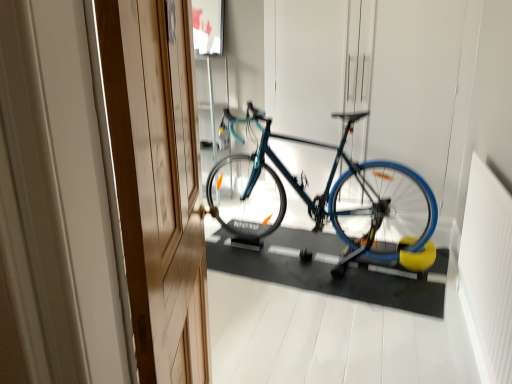
Question: Is wooden door at left taller or shorter than shiny blue bicycle at center?

Choices:
 (A) short
 (B) tall

Answer: (B)

Question: From a real-world perspective, is wooden door at left physically located above or below shiny blue bicycle at center?

Choices:
 (A) below
 (B) above

Answer: (B)

Question: From the image's perspective, relative to shiny blue bicycle at center, is wooden door at left above or below?

Choices:
 (A) above
 (B) below

Answer: (B)

Question: Looking at their shapes, would you say shiny blue bicycle at center is wider or thinner than wooden door at left?

Choices:
 (A) thin
 (B) wide

Answer: (B)

Question: From the image's perspective, is shiny blue bicycle at center located above or below wooden door at left?

Choices:
 (A) below
 (B) above

Answer: (B)

Question: Is shiny blue bicycle at center spatially inside wooden door at left, or outside of it?

Choices:
 (A) inside
 (B) outside

Answer: (B)

Question: From their relative heights in the image, would you say shiny blue bicycle at center is taller or shorter than wooden door at left?

Choices:
 (A) tall
 (B) short

Answer: (B)